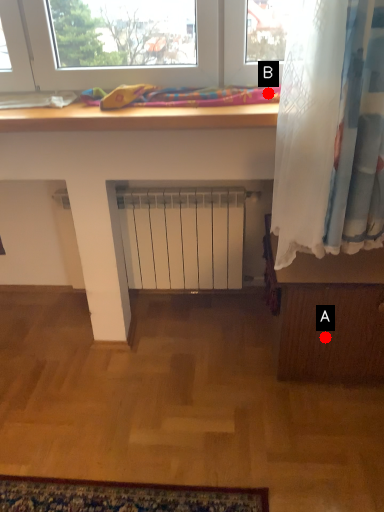
Question: Two points are circled on the image, labeled by A and B beside each circle. Which point is farther from the camera taking this photo?

Choices:
 (A) A is further
 (B) B is further

Answer: (A)